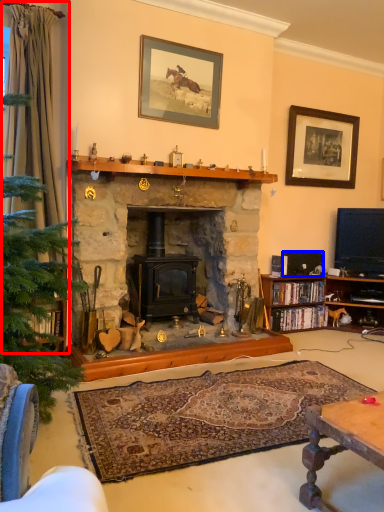
Question: Which object appears closest to the camera in this image, curtain (highlighted by a red box) or corded phone (highlighted by a blue box)?

Choices:
 (A) curtain
 (B) corded phone

Answer: (A)